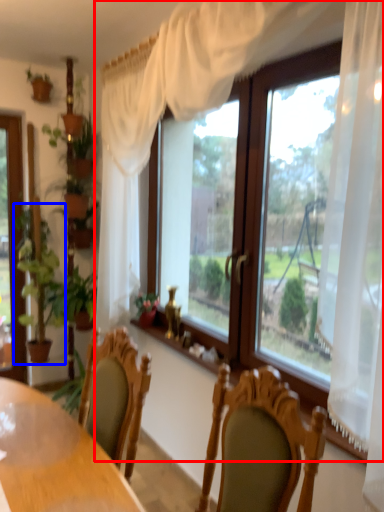
Question: Which of the following is the closest to the observer, window (highlighted by a red box) or houseplant (highlighted by a blue box)?

Choices:
 (A) window
 (B) houseplant

Answer: (A)